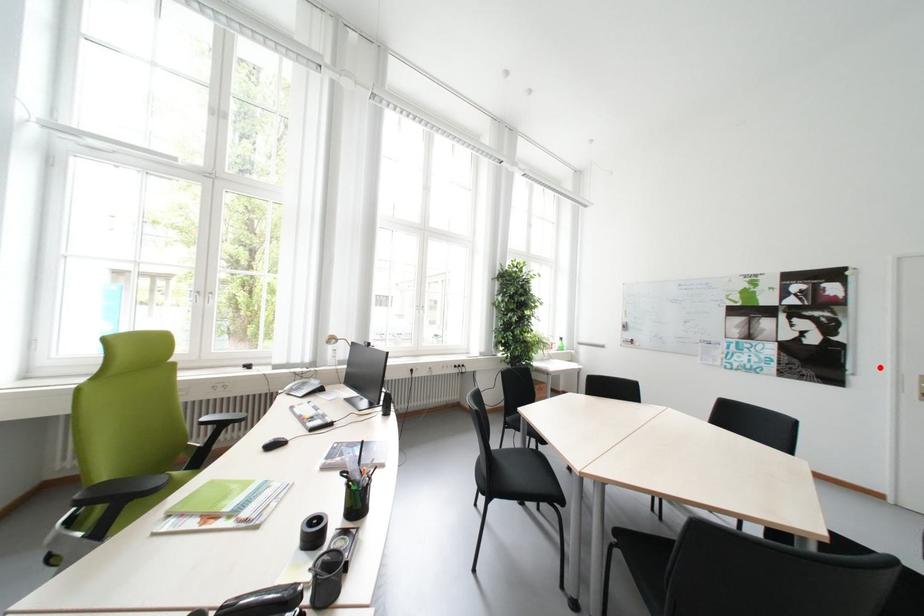
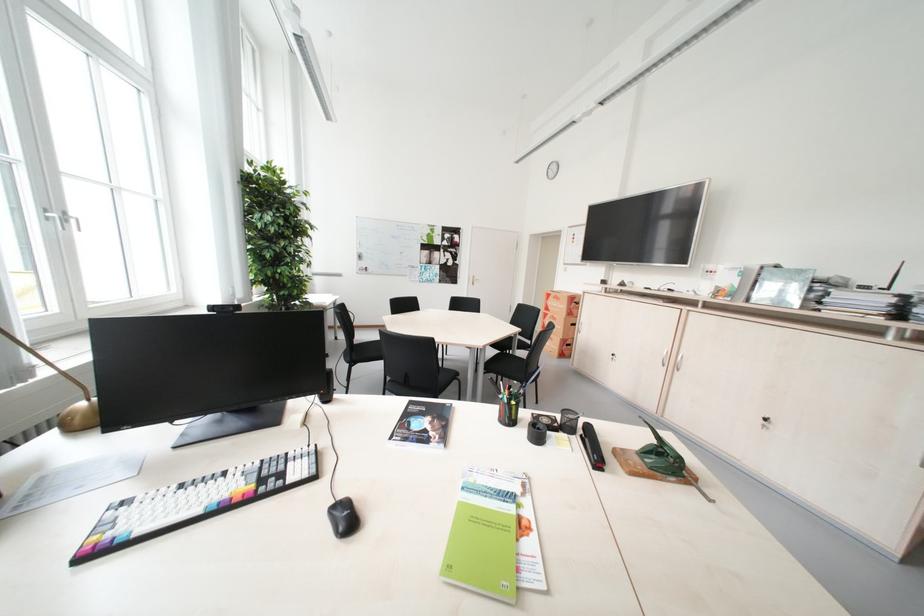
Find the pixel in the second image that matches the highlighted location in the first image.

(473, 275)